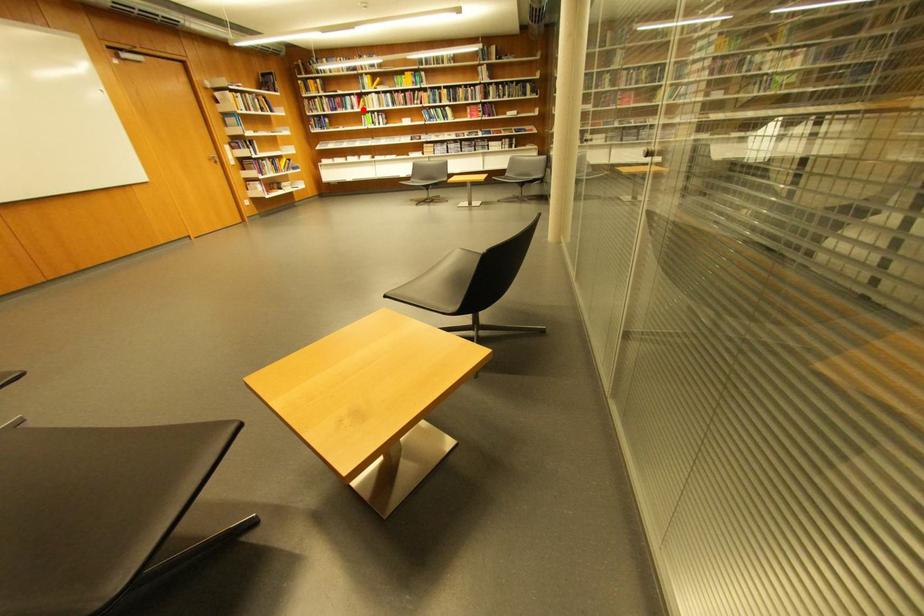
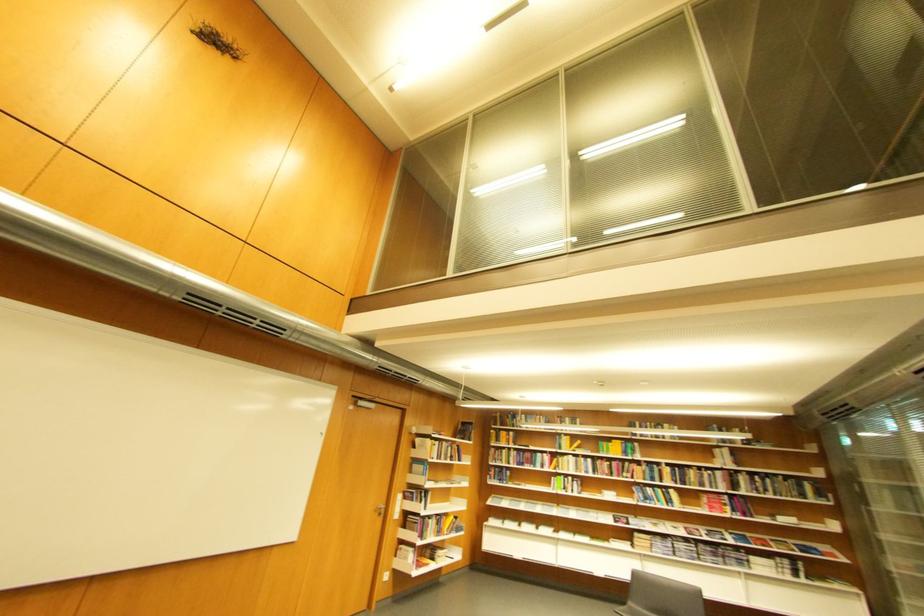
Where in the second image is the point corresponding to the highlighted location from the first image?

(553, 468)